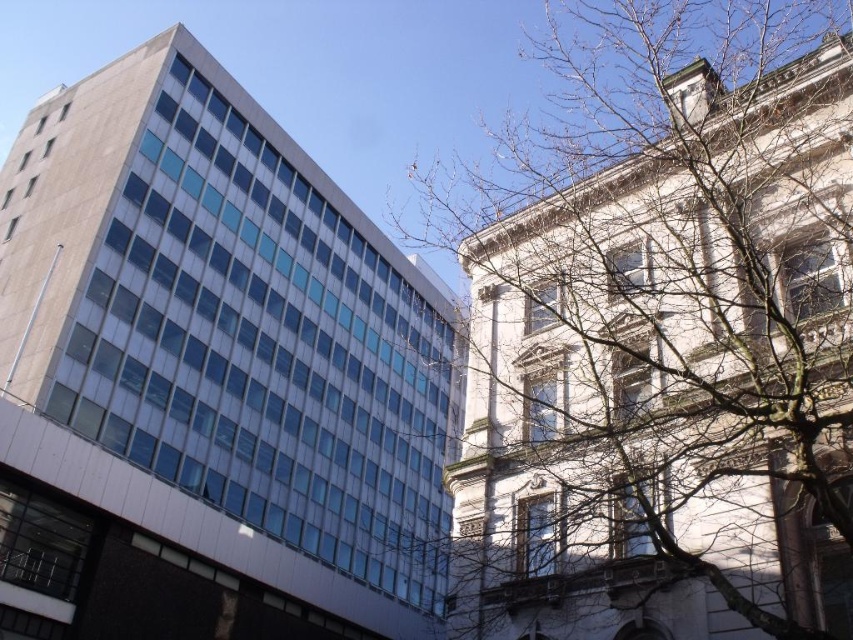
Question: Which of the following is the farthest from the observer?

Choices:
 (A) (173, 147)
 (B) (714, 435)

Answer: (A)

Question: Which of the following is the farthest from the observer?

Choices:
 (A) bare branches at upper right
 (B) matte glass building at left

Answer: (B)

Question: Which point is farther to the camera?

Choices:
 (A) matte glass building at left
 (B) bare branches at upper right

Answer: (A)

Question: Is bare branches at upper right thinner than matte glass building at left?

Choices:
 (A) yes
 (B) no

Answer: (B)

Question: Is bare branches at upper right thinner than matte glass building at left?

Choices:
 (A) no
 (B) yes

Answer: (A)

Question: Does bare branches at upper right have a larger size compared to matte glass building at left?

Choices:
 (A) no
 (B) yes

Answer: (B)